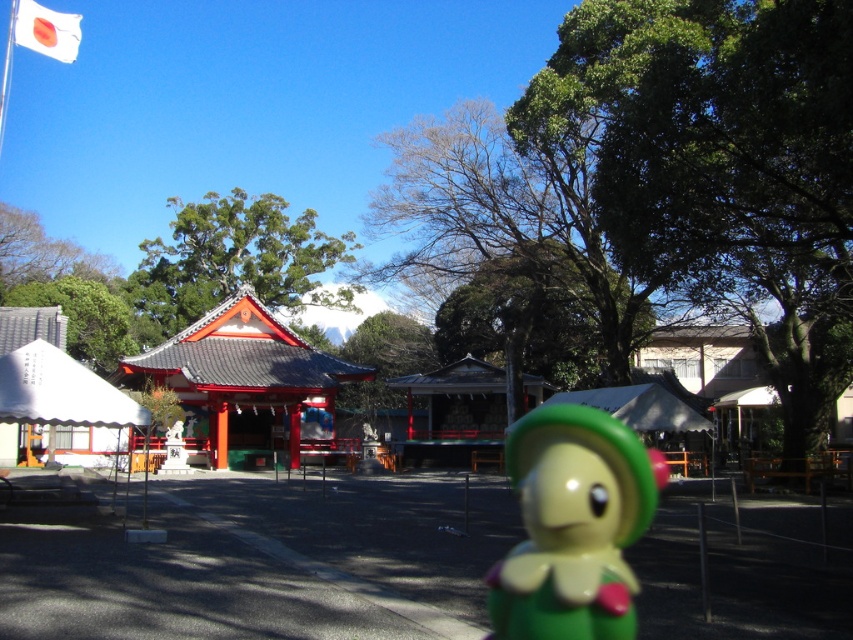
Question: Which of the following is the farthest from the observer?

Choices:
 (A) (619, 621)
 (B) (20, 13)

Answer: (B)

Question: Which point is closer to the camera?

Choices:
 (A) green glossy doll at lower center
 (B) white fabric flag at upper left

Answer: (A)

Question: Does green glossy doll at lower center appear on the left side of white fabric flag at upper left?

Choices:
 (A) yes
 (B) no

Answer: (B)

Question: Does green glossy doll at lower center have a larger size compared to white fabric flag at upper left?

Choices:
 (A) no
 (B) yes

Answer: (A)

Question: Is green glossy doll at lower center wider than white fabric flag at upper left?

Choices:
 (A) no
 (B) yes

Answer: (A)